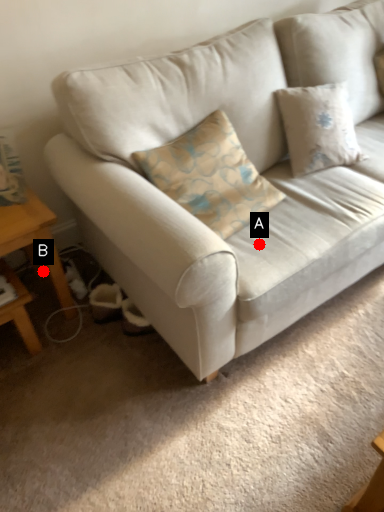
Question: Two points are circled on the image, labeled by A and B beside each circle. Which of the following is the farthest from the observer?

Choices:
 (A) A is further
 (B) B is further

Answer: (B)